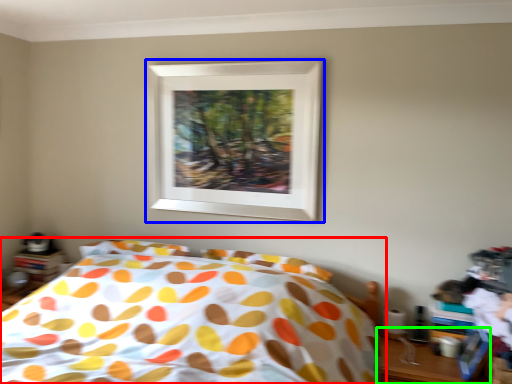
Question: Which object is the farthest from bed (highlighted by a red box)? Choose among these: picture frame (highlighted by a blue box) or table (highlighted by a green box).

Choices:
 (A) picture frame
 (B) table

Answer: (B)